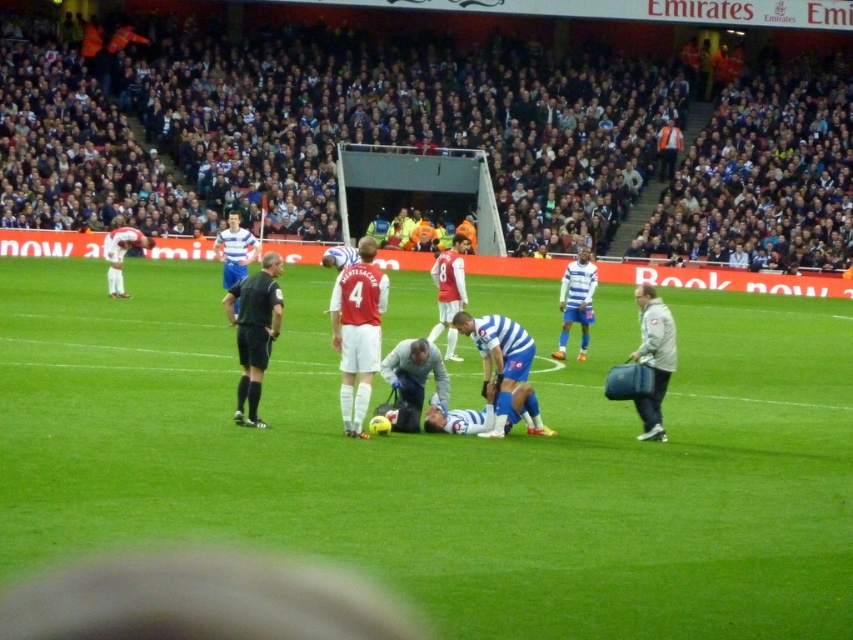
Question: Which object is positioned farthest from the gray fabric bag at center?

Choices:
 (A) blue fabric player at center
 (B) black uniform at center

Answer: (A)

Question: Based on their relative distances, which object is farther from the white matte jersey at center?

Choices:
 (A) black uniform at center
 (B) gray fabric bag at center
 (C) blue fabric player at center
 (D) gray fabric bag at right

Answer: (C)

Question: Is black uniform at center to the left of gray fabric bag at center from the viewer's perspective?

Choices:
 (A) yes
 (B) no

Answer: (A)

Question: Is green grass field at center bigger than gray fabric bag at right?

Choices:
 (A) yes
 (B) no

Answer: (A)

Question: Can you confirm if green grass field at center is positioned to the left of blue fabric player at center?

Choices:
 (A) yes
 (B) no

Answer: (A)

Question: Which object is farther from the camera taking this photo?

Choices:
 (A) blue fabric player at center
 (B) black uniform at center
 (C) white matte jersey at center
 (D) gray fabric bag at right

Answer: (A)